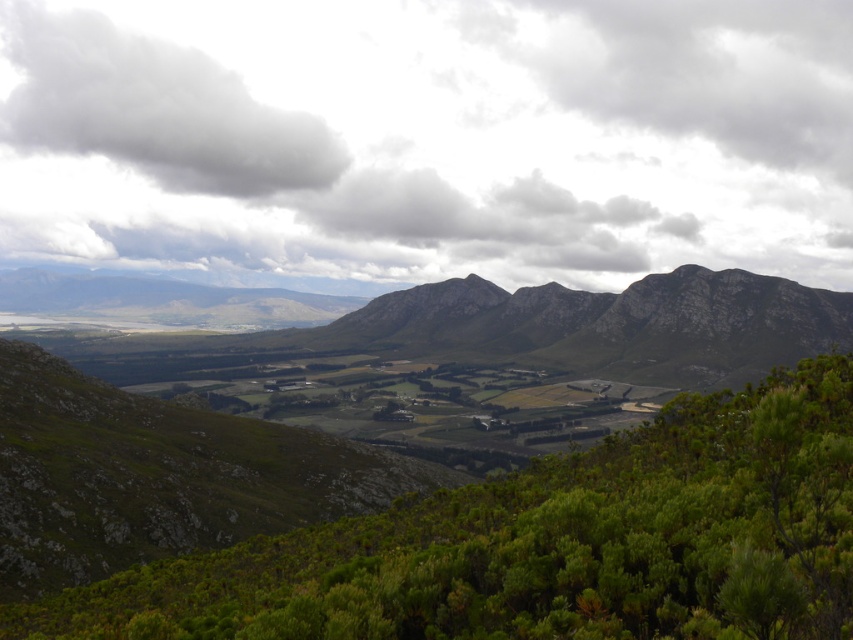
From the picture: Based on the scene described, which object occupies a higher position in the image? Please refer to the objects listed below for your answer. Objects available for selection are cloudy sky at upper center and green leafy shrub at lower center.

The cloudy sky at upper center is much taller than the green leafy shrub at lower center, so the cloudy sky at upper center occupies a higher position in the image.

You are a hiker looking at the mountain view. You see the green rough rock at center and the white fluffy cloud at upper left. Which object is positioned higher in the sky?

The white fluffy cloud at upper left is higher in the sky than the green rough rock at center because the green rough rock at center is below the white fluffy cloud at upper left.

Based on the photo, you are an airplane pilot flying over the mountainous landscape. You notice the cloudy sky at upper center and the white fluffy cloud at upper left in your view. Which of these two has a higher position in the sky?

The cloudy sky at upper center has a greater height compared to the white fluffy cloud at upper left, so the cloudy sky at upper center is higher in the sky.